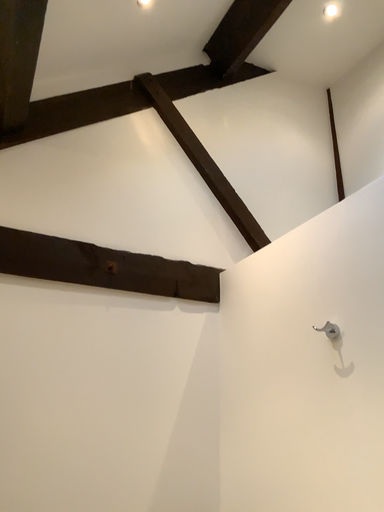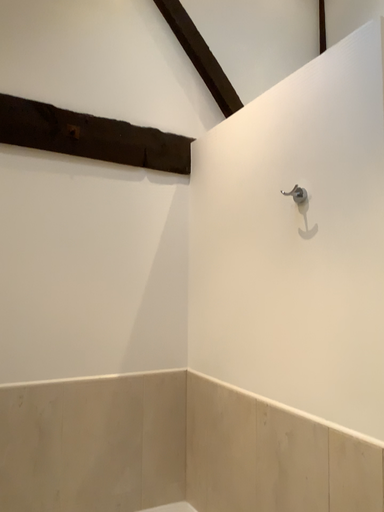
Question: Which way did the camera rotate in the video?

Choices:
 (A) rotated downward
 (B) rotated upward

Answer: (A)